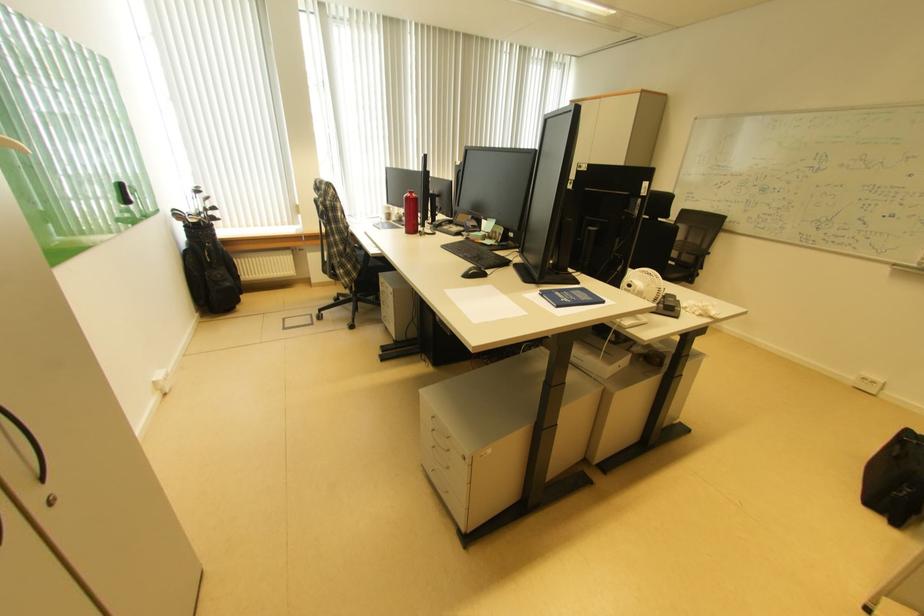
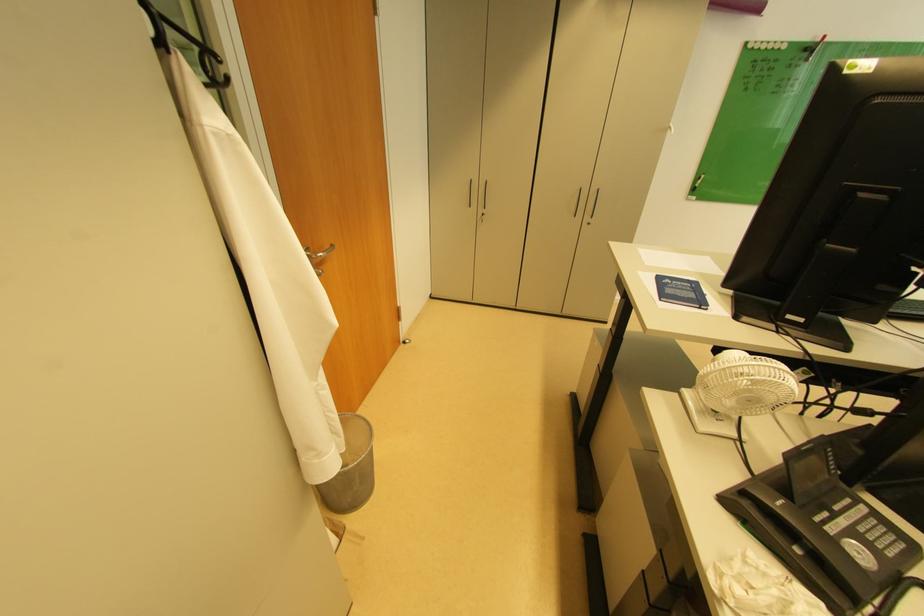
Where in the second image is the point corresponding to point (565, 294) from the first image?

(697, 286)